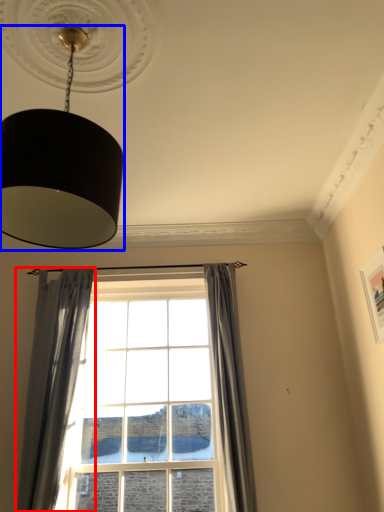
Question: Which object appears closest to the camera in this image, curtain (highlighted by a red box) or lamp (highlighted by a blue box)?

Choices:
 (A) curtain
 (B) lamp

Answer: (B)